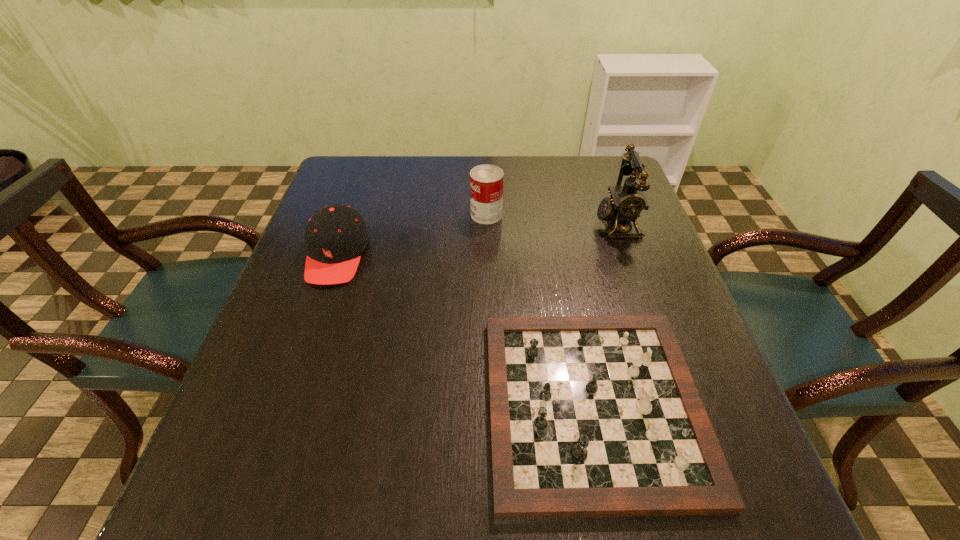
In order to click on vacant space located on the front label of the can in this screenshot , I will do `click(395, 214)`.

Locate an element on the screen. vacant region located 0.070m on the front label of the can is located at coordinates (444, 214).

The height and width of the screenshot is (540, 960). Find the location of `free location located 0.250m on the front-facing side of the third tallest object`. free location located 0.250m on the front-facing side of the third tallest object is located at coordinates (292, 387).

I want to click on blank space located 0.070m on the left of the shortest object, so click(x=448, y=405).

This screenshot has height=540, width=960. Identify the location of object present at the near edge. (591, 416).

Locate an element on the screen. object located at the left edge is located at coordinates (336, 236).

Image resolution: width=960 pixels, height=540 pixels. What are the coordinates of `telephone that is at the right edge` in the screenshot? It's located at (626, 203).

Where is `chessboard located in the right edge section of the desktop`? The image size is (960, 540). chessboard located in the right edge section of the desktop is located at coordinates (591, 416).

Image resolution: width=960 pixels, height=540 pixels. Identify the location of object present at the near right corner. (591, 416).

The width and height of the screenshot is (960, 540). I want to click on vacant area at the far edge of the desktop, so click(557, 174).